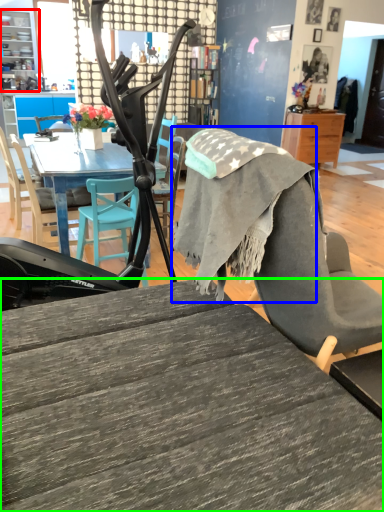
Question: Which object is positioned farthest from cabinetry (highlighted by a red box)? Select from fabric (highlighted by a blue box) and desk (highlighted by a green box).

Choices:
 (A) fabric
 (B) desk

Answer: (B)